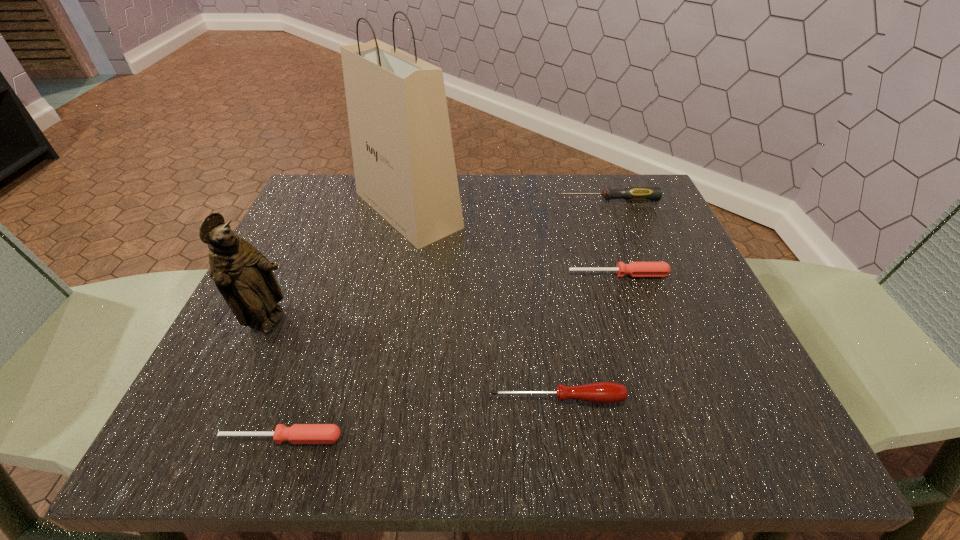
The height and width of the screenshot is (540, 960). I want to click on screwdriver located at the left edge, so tap(298, 433).

Find the location of a particular element. This screenshot has width=960, height=540. object at the far left corner is located at coordinates (403, 157).

Find the location of a particular element. object that is at the near left corner is located at coordinates (298, 433).

At what (x,y) coordinates should I click in order to perform the action: click on object situated at the far right corner. Please return your answer as a coordinate pair (x, y). This screenshot has width=960, height=540. Looking at the image, I should click on (630, 193).

In the image, there is a desktop. In order to click on vacant space at the far edge in this screenshot , I will do `click(473, 192)`.

The image size is (960, 540). I want to click on vacant region at the near edge of the desktop, so click(x=543, y=395).

Locate an element on the screen. Image resolution: width=960 pixels, height=540 pixels. vacant space at the left edge of the desktop is located at coordinates (282, 252).

In the image, there is a desktop. At what (x,y) coordinates should I click in order to perform the action: click on vacant space at the right edge. Please return your answer as a coordinate pair (x, y). The height and width of the screenshot is (540, 960). Looking at the image, I should click on (618, 253).

Find the location of a particular element. The height and width of the screenshot is (540, 960). vacant space at the far left corner of the desktop is located at coordinates (314, 198).

Find the location of a particular element. vacant space at the far right corner of the desktop is located at coordinates (623, 181).